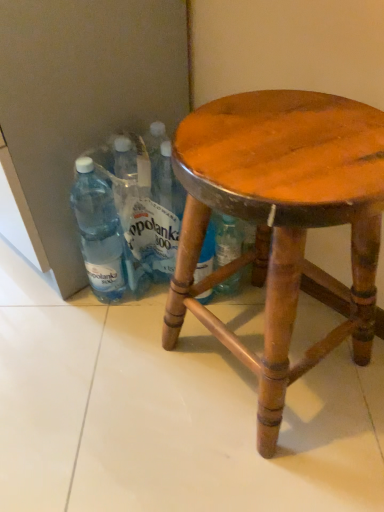
You are a GUI agent. You are given a task and a screenshot of the screen. Output one action in this format:
    pyautogui.click(x=<x>, y=<y>)
    Task: Click on the free region on the left part of transparent plastic bottles at lower left
    
    Given the screenshot: What is the action you would take?
    click(45, 301)